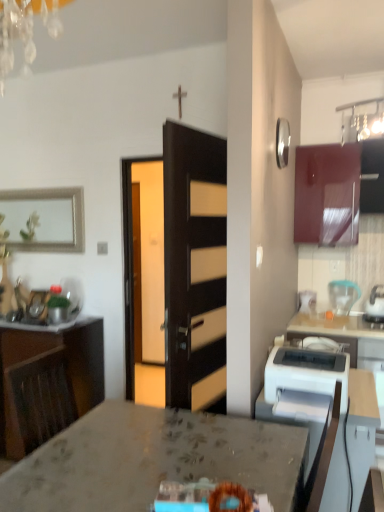
Where is `free space above marble countertop at center (from a real-world perspective)`? free space above marble countertop at center (from a real-world perspective) is located at coordinates (132, 457).